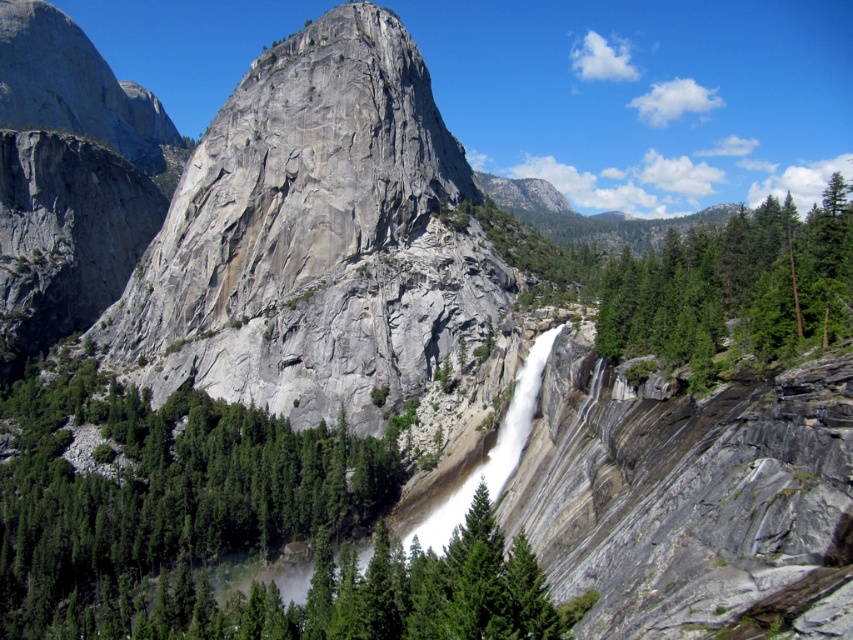
Question: Which is farther from the green textured rock at center?

Choices:
 (A) gray/rough rock at center
 (B) green textured tree at center-right

Answer: (B)

Question: Can you confirm if green textured rock at center is positioned to the right of green textured tree at center-right?

Choices:
 (A) yes
 (B) no

Answer: (B)

Question: Is the position of green textured rock at center less distant than that of green textured tree at center-right?

Choices:
 (A) no
 (B) yes

Answer: (B)

Question: Which point is closer to the camera taking this photo?

Choices:
 (A) (424, 294)
 (B) (691, 234)

Answer: (B)

Question: Which of these objects is positioned closest to the green textured rock at center?

Choices:
 (A) green textured tree at center-right
 (B) gray/rough rock at center

Answer: (B)

Question: In this image, where is gray/rough rock at center located relative to green textured rock at center?

Choices:
 (A) above
 (B) below

Answer: (A)